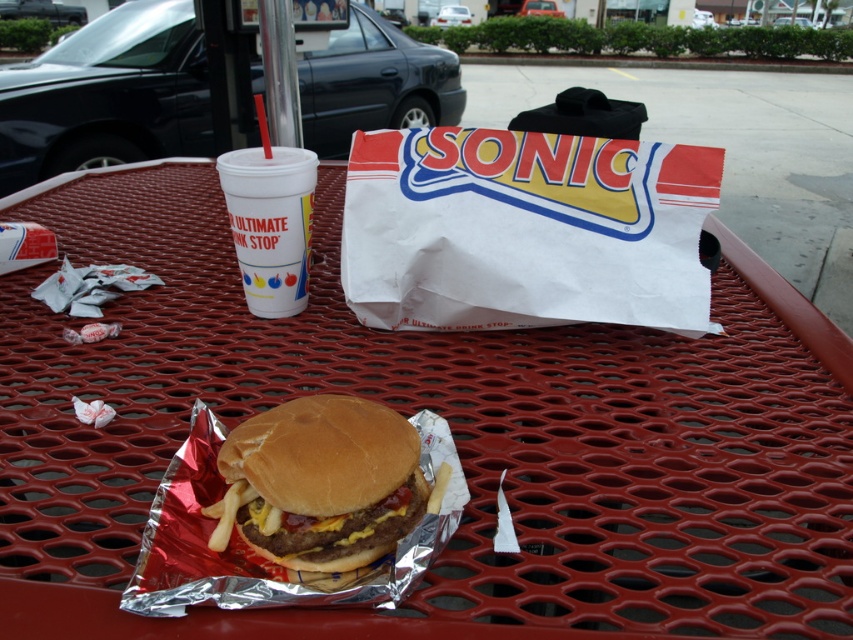
Where is the brown toasted bun at center located in the image?

The brown toasted bun at center is located at point [320,483].

You are a customer at Sonic Drive In and you want to grab the brown toasted bun at center and the white styrofoam cup at center from the table. Which one is closer to you?

The brown toasted bun at center is closer to you because it is in front of the white styrofoam cup at center.